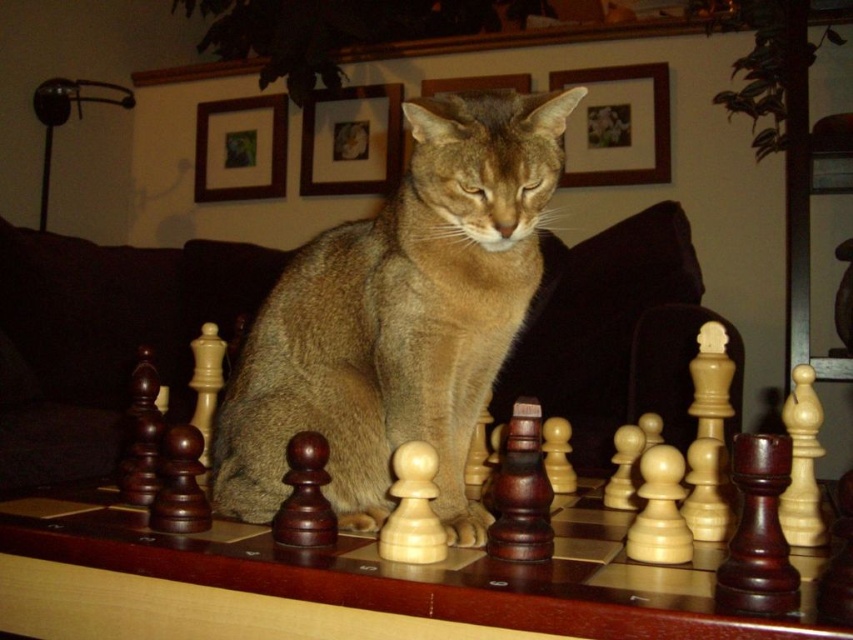
You are a photographer taking a picture of the golden fur cat at center. The camera has a focus point at coordinate point (399, 317). Will this point be on the golden fur cat at center?

Yes, the point (399, 317) is on the golden fur cat at center, so the focus point will be on the cat.

You are standing in the room and want to place a small plant between the two points, point (413, 252) and point (407, 602). Which point should the plant be closer to so it doesn t block the view of the chessboard?

The plant should be placed closer to point (413, 252) because it is behind point (407, 602), so placing it closer to the rear point would keep it from obstructing the chessboard view.

You are holding a 100 cm long ruler and want to measure the distance between the camera and the point at coordinates (469, 541). Can you determine if the ruler will be long enough to measure this distance?

The distance between the camera and the point at coordinates (469, 541) is 88.19 centimeters. Since the ruler is 100 cm long, it is long enough to measure the distance.